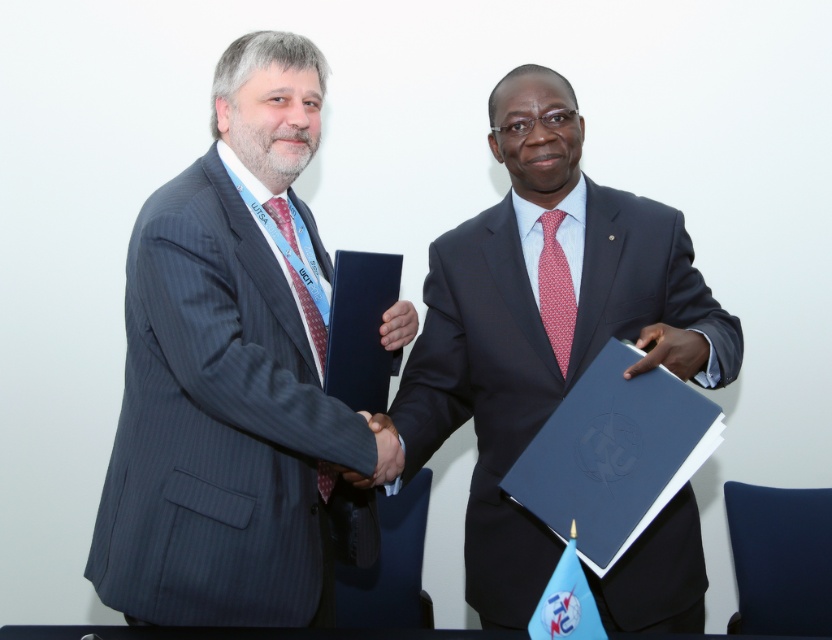
Which is below, dark blue leather folder at center or black smooth hand at center?

black smooth hand at center is lower down.

Who is more forward, (704, 339) or (395, 474)?

Point (395, 474)

Locate an element on the screen. The image size is (832, 640). dark blue leather folder at center is located at coordinates (670, 349).

Between matte black suit at left and red dotted fabric tie at center, which one appears on the right side from the viewer's perspective?

red dotted fabric tie at center

Does matte black suit at left have a greater height compared to red dotted fabric tie at center?

Yes.

Who is more distant from viewer, (314, 506) or (557, 272)?

Positioned behind is point (557, 272).

Locate an element on the screen. matte black suit at left is located at coordinates (233, 378).

Consider the image. Is matte black suit at left to the left of matte red tie at left from the viewer's perspective?

Correct, you'll find matte black suit at left to the left of matte red tie at left.

What do you see at coordinates (233, 378) in the screenshot? I see `matte black suit at left` at bounding box center [233, 378].

Where is `matte black suit at left`? matte black suit at left is located at coordinates (233, 378).